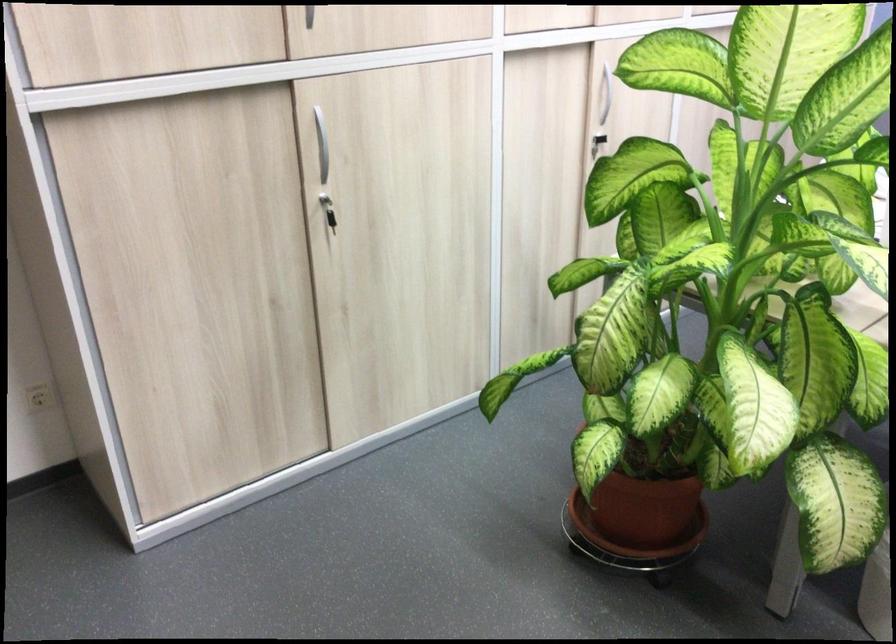
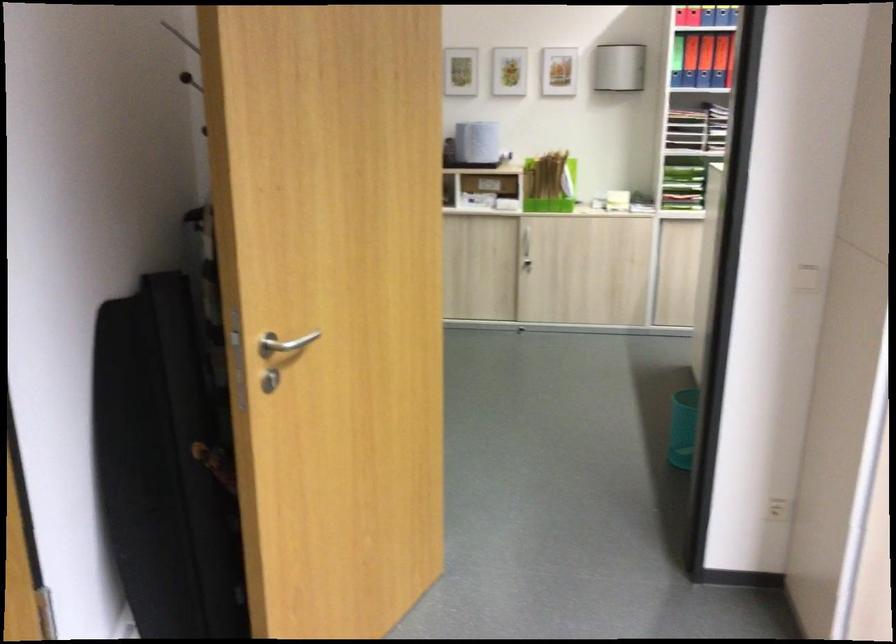
Question: The camera is either moving clockwise (left) or counter-clockwise (right) around the object. The first image is from the beginning of the video and the second image is from the end. Is the camera moving left or right when shooting the video?

Choices:
 (A) Left
 (B) Right

Answer: (B)